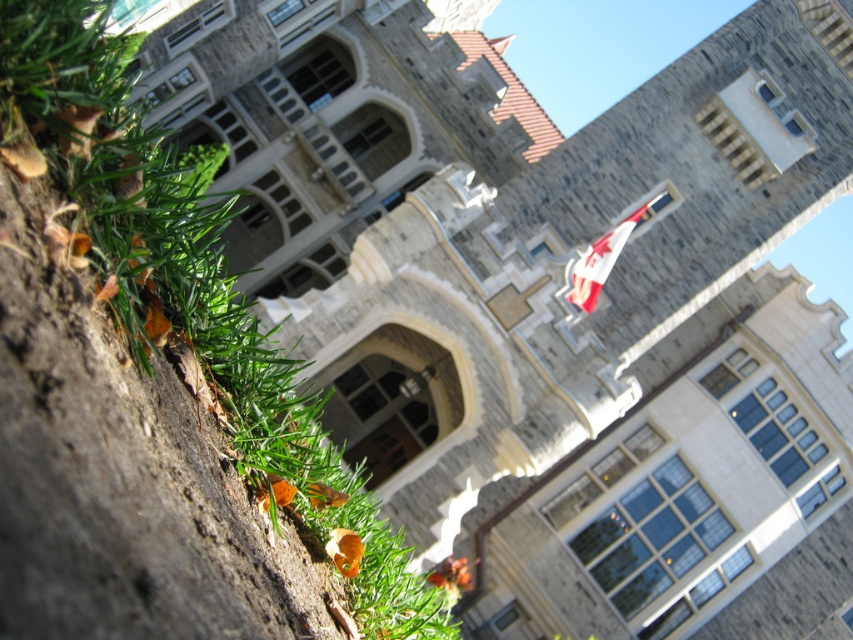
You are a landscape architect planning to install a new pathway. You need to know which area is wider between the green grass at lower left and the red fabric flag at upper center to decide where to place the pathway. Which one is wider?

The green grass at lower left is wider than the red fabric flag at upper center, so the pathway should be placed in the wider area, which is the green grass at lower left.

You are standing at the entrance of the grand stone building and want to walk towards the green grass at lower left. Which direction should you face to walk straight towards it?

To walk straight towards the green grass at lower left, you should face the direction corresponding to the 2D location point at coordinates (151, 387).

You are standing in front of the grand stone building and want to take a photo of the green grass at lower left and the red fabric flag at upper center. Which object is closer to the camera? Please explain your reasoning based on their positions.

The green grass at lower left is positioned under the red fabric flag at upper center, meaning the grass is closer to the camera since it is below the flag in the scene.